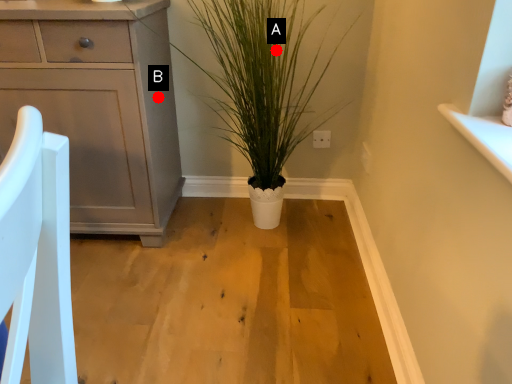
Question: Two points are circled on the image, labeled by A and B beside each circle. Which point appears farthest from the camera in this image?

Choices:
 (A) A is further
 (B) B is further

Answer: (B)